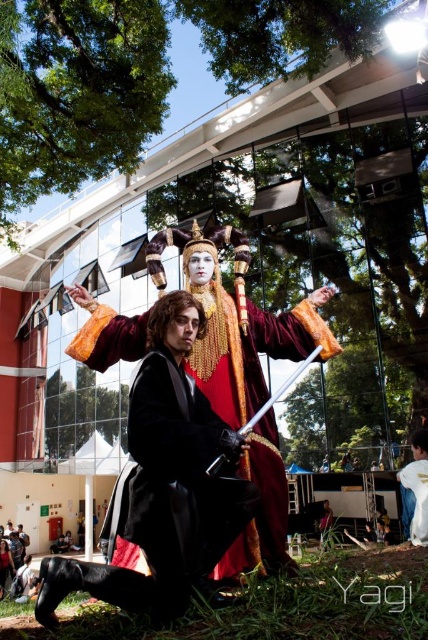
You are a photographer at the event and need to position a spotlight on the taller object between the velvet maroon cape at center and the matte black dress at lower left. Which object should you choose?

The velvet maroon cape at center is much taller than the matte black dress at lower left, so you should position the spotlight on the velvet maroon cape at center.

You are standing in the park and see the white matte shirt at lower right. If you want to approach it, how many steps would you need to take if each step is about 3 feet long?

The white matte shirt at lower right is 45.83 feet away from the viewer. Dividing the distance by the step length of 3 feet gives approximately 15.28 steps. Since you can only take whole steps, you would need to take about 15 steps to reach the white matte shirt at lower right.